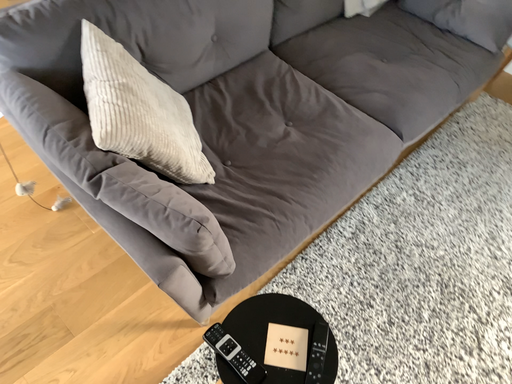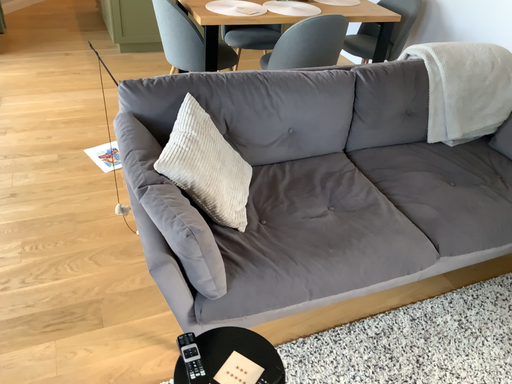
Question: How did the camera likely rotate when shooting the video?

Choices:
 (A) rotated downward
 (B) rotated upward

Answer: (B)